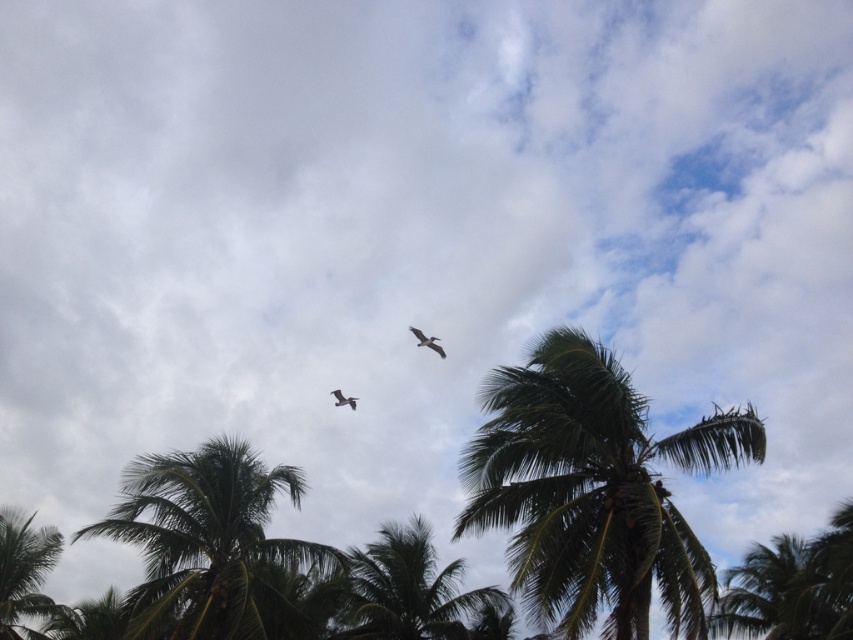
Question: Is dark green leafy coconut tree at lower left thinner than green leafy coconut tree at lower right?

Choices:
 (A) yes
 (B) no

Answer: (B)

Question: Can you confirm if green leafy coconut tree at center is smaller than green leafy palm tree at lower center?

Choices:
 (A) no
 (B) yes

Answer: (A)

Question: Does dark green leafy coconut tree at lower left have a greater width compared to white matte bird at center?

Choices:
 (A) yes
 (B) no

Answer: (A)

Question: Which point appears farthest from the camera in this image?

Choices:
 (A) 527,497
 (B) 251,604

Answer: (A)

Question: Estimate the real-world distances between objects in this image. Which object is closer to the dark green leafy coconut tree at lower left?

Choices:
 (A) green leafy palm tree at lower center
 (B) green leafy coconut tree at center

Answer: (A)

Question: Which is nearer to the white matte bird at center?

Choices:
 (A) green leafy coconut tree at center
 (B) dark green leafy coconut tree at lower left
 (C) green leafy coconut tree at lower right

Answer: (B)